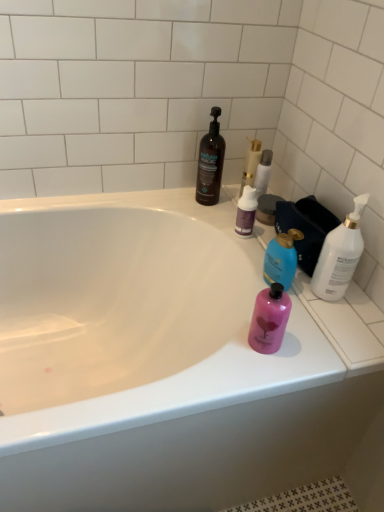
Question: In the image, is white glossy bottle at right, which appears as the 5th bottle when viewed from the left, positioned in front of or behind purple matte bottle at upper center, the fourth bottle in the right-to-left sequence?

Choices:
 (A) behind
 (B) front

Answer: (B)

Question: Is point (354, 224) positioned closer to the camera than point (254, 200)?

Choices:
 (A) farther
 (B) closer

Answer: (B)

Question: Which is farther from the dark brown plastic bottle at upper center, arranged as the 5th bottle when viewed from the right?

Choices:
 (A) silver metallic tube at upper center
 (B) pink matte bottle at right, marked as the third bottle in a left-to-right arrangement
 (C) white glossy bottle at right, which appears as the 5th bottle when viewed from the left
 (D) gold metallic candle at upper center
 (E) white glossy bathtub at upper center

Answer: (E)

Question: Estimate the real-world distances between objects in this image. Which object is closer to the blue glossy bottle at upper right, the fourth bottle positioned from the left?

Choices:
 (A) silver metallic tube at upper center
 (B) dark brown plastic bottle at upper center, arranged as the first bottle when viewed from the left
 (C) white glossy bathtub at upper center
 (D) purple matte bottle at upper center, the fourth bottle in the right-to-left sequence
 (E) pink matte bottle at right, marked as the third bottle in a left-to-right arrangement

Answer: (E)